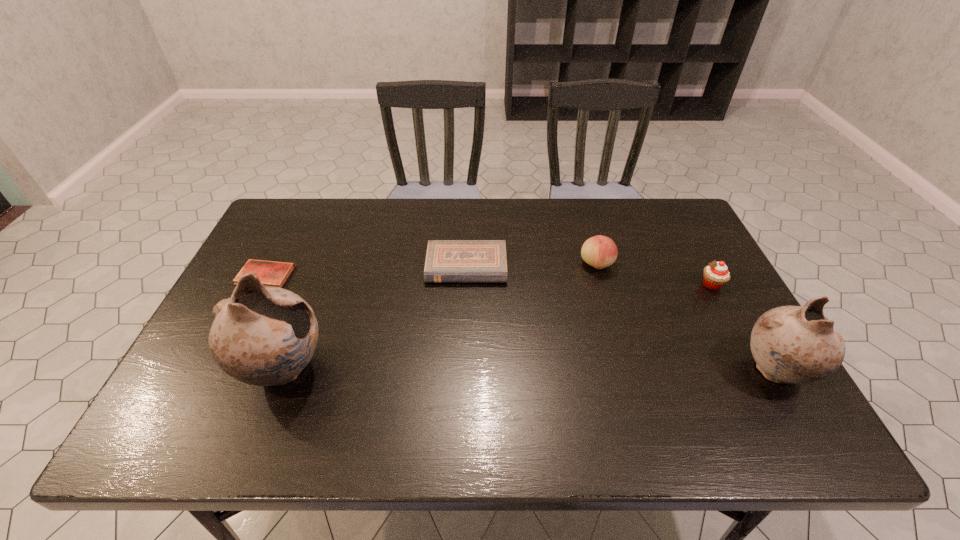
Locate an element on the screen. The image size is (960, 540). empty space that is in between the fifth shortest object and the fourth object from left to right is located at coordinates [685, 318].

Find the location of `vacant region between the tallest object and the fourth object from right to left`. vacant region between the tallest object and the fourth object from right to left is located at coordinates [x=375, y=318].

Select which object is the third closest to the fourth object from left to right. Please provide its 2D coordinates. Your answer should be formatted as a tuple, i.e. [(x, y)], where the tuple contains the x and y coordinates of a point satisfying the conditions above.

[(790, 344)]

At what (x,y) coordinates should I click in order to perform the action: click on object that is the fifth closest to the fourth object from right to left. Please return your answer as a coordinate pair (x, y). Looking at the image, I should click on (790, 344).